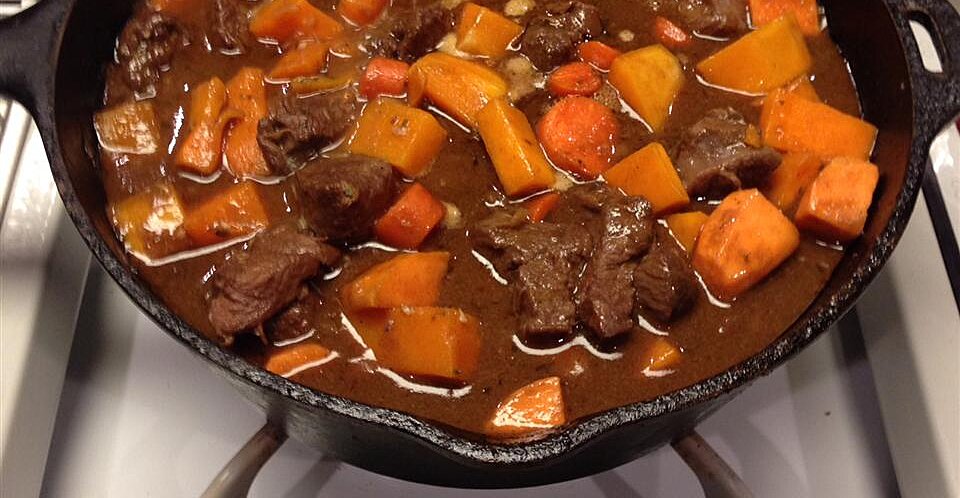
Where is `pot`? This screenshot has height=498, width=960. pot is located at coordinates (680, 415).